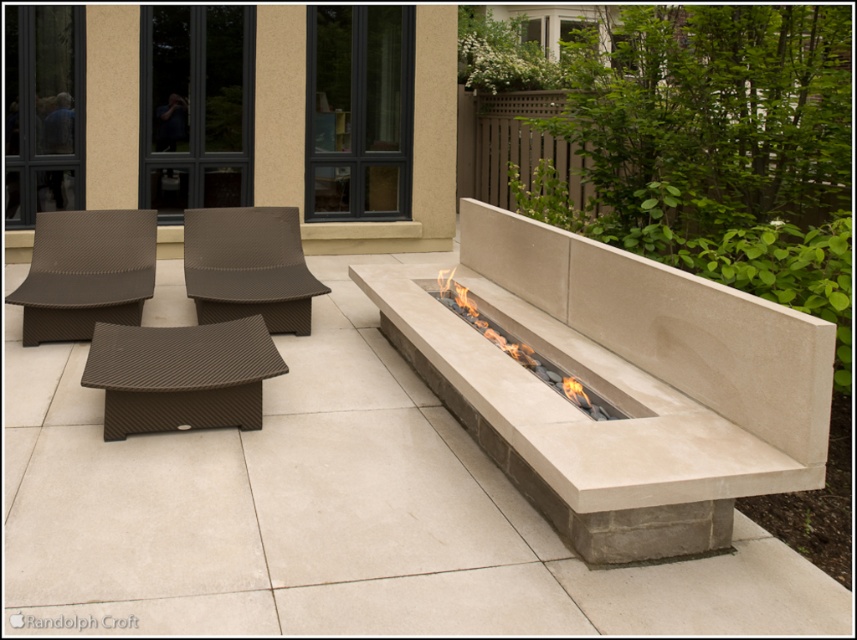
Question: Which of the following is the closest to the observer?

Choices:
 (A) (496, 332)
 (B) (555, 445)

Answer: (B)

Question: Which point appears closest to the camera in this image?

Choices:
 (A) (292, 230)
 (B) (144, 433)

Answer: (B)

Question: Does beige concrete fire pit at center have a lesser width compared to beige stone fire pit at center?

Choices:
 (A) no
 (B) yes

Answer: (A)

Question: Is beige concrete fire pit at center below beige stone fire pit at center?

Choices:
 (A) no
 (B) yes

Answer: (A)

Question: Is beige concrete fire pit at center closer to the viewer compared to brown woven chair at center?

Choices:
 (A) yes
 (B) no

Answer: (A)

Question: Among these objects, which one is farthest from the camera?

Choices:
 (A) beige concrete fire pit at center
 (B) beige stone fire pit at center
 (C) brown woven chair at left

Answer: (C)